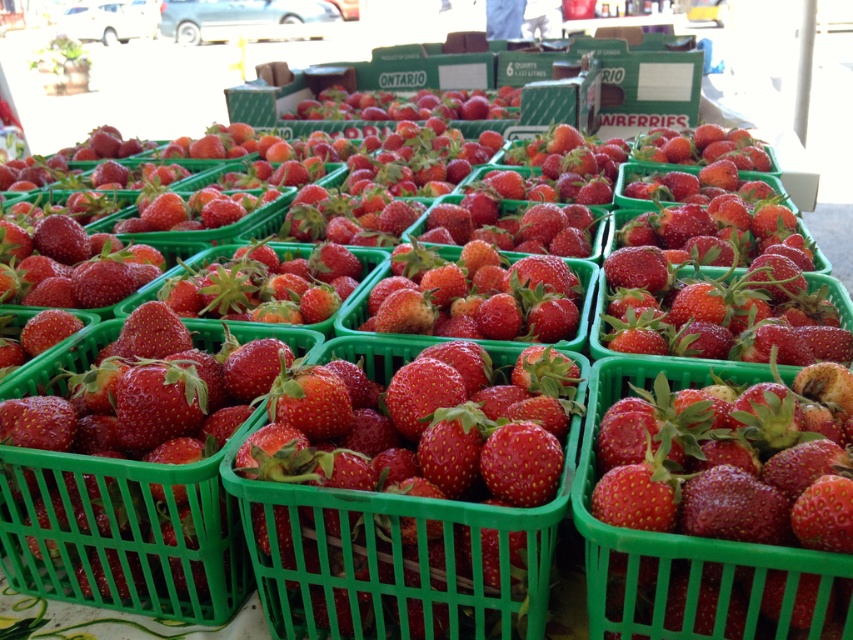
You are a customer at a market and want to buy both the glossy plastic strawberries at center and the glossy plastic basket at center. However, you have a limited space in your bag. Which item will take up more space?

The glossy plastic strawberries at center will take up more space because they have a larger size compared to the glossy plastic basket at center.

You are a delivery person who needs to pick up a package from the center of the crates. The coordinates of the package are at point 0.873, 0.469. Can you confirm if the glossy plastic strawberries at center are exactly at this coordinate?

The glossy plastic strawberries at center are located at point (399, 557), so yes, they are exactly at that coordinate.

You are a customer at a market stand and want to buy the strawberries located at point (399, 557). Can you confirm if there are strawberries at that exact point?

Yes, at point (399, 557) there are glossy plastic strawberries at center.